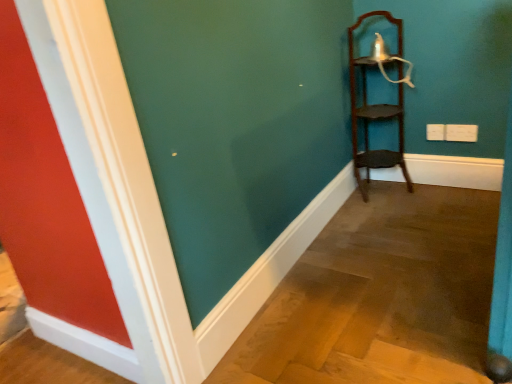
Find the location of `dark wood shelf at upper right`. dark wood shelf at upper right is located at coordinates (377, 104).

Describe the element at coordinates (377, 104) in the screenshot. The height and width of the screenshot is (384, 512). I see `dark wood shelf at upper right` at that location.

Where is `dark wood shelf at upper right`? dark wood shelf at upper right is located at coordinates (377, 104).